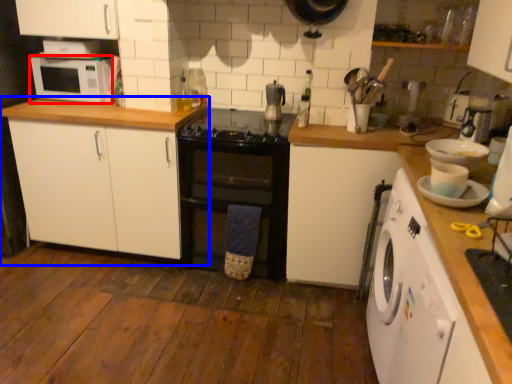
Question: Which object is closer to the camera taking this photo, microwave oven (highlighted by a red box) or cabinetry (highlighted by a blue box)?

Choices:
 (A) microwave oven
 (B) cabinetry

Answer: (B)